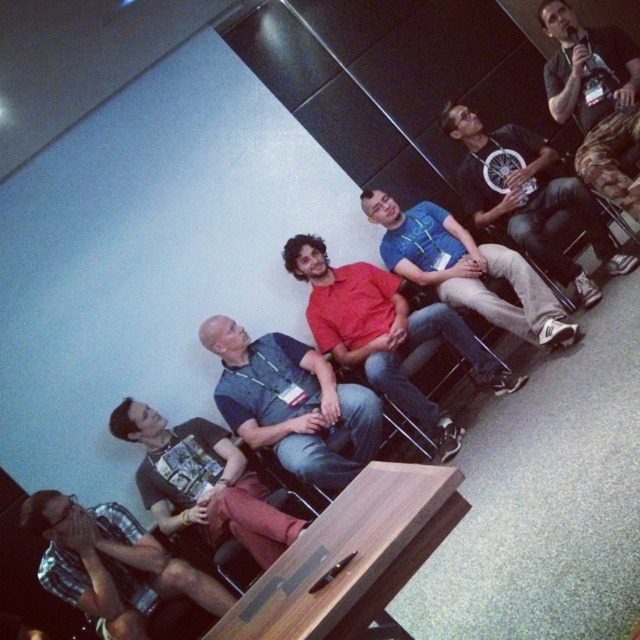
Can you confirm if dark gray shirt at center is positioned below matte black shirt at center?

Yes.

Where is `dark gray shirt at center`? dark gray shirt at center is located at coordinates (291, 403).

Between point (205, 320) and point (550, 163), which one is positioned in front?

Point (205, 320) is more forward.

At what (x,y) coordinates should I click in order to perform the action: click on dark gray shirt at center. Please return your answer as a coordinate pair (x, y). This screenshot has width=640, height=640. Looking at the image, I should click on (291, 403).

Between dark gray shirt at center and matte red shirt at center, which one has more height?

matte red shirt at center is taller.

Is dark gray shirt at center thinner than matte red shirt at center?

Yes.

Is point (272, 394) farther from camera compared to point (448, 433)?

No.

Locate an element on the screen. The height and width of the screenshot is (640, 640). dark gray shirt at center is located at coordinates tap(291, 403).

Does matte red shirt at center have a lesser width compared to blue t-shirt at center?

Incorrect, matte red shirt at center's width is not less than blue t-shirt at center's.

Who is more distant from viewer, [440,435] or [547,296]?

The point [440,435] is behind.

Where is `matte red shirt at center`? matte red shirt at center is located at coordinates (385, 332).